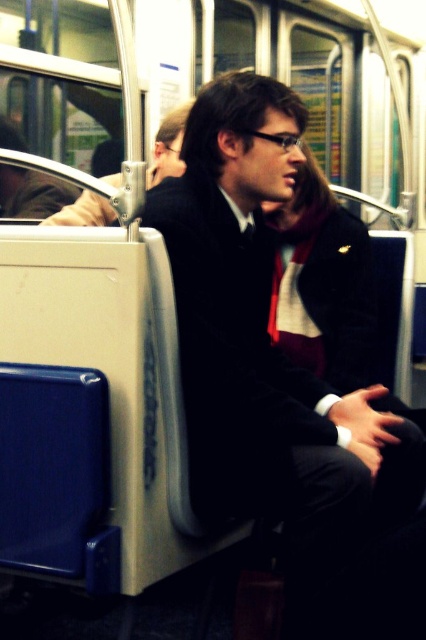
You are a photographer trying to capture a closeup of the matte black jacket at center and the matte black jacket at upper left. Since you want to focus on both jackets clearly, which one should you adjust your camera focus to prioritize based on their sizes?

The matte black jacket at center is wider than the matte black jacket at upper left, so you should prioritize focusing on the matte black jacket at center to ensure both are in focus as it takes up more space in the frame.

You are standing on the train and want to move from the point at coordinates point (x=281, y=145) to the point at coordinates point (x=170, y=116). Can you walk directly towards the second point without any obstacles in between?

Point (x=281, y=145) is in front of point (x=170, y=116), so there might be an obstacle between them. Therefore, you cannot walk directly towards the second point without any obstacles in between.